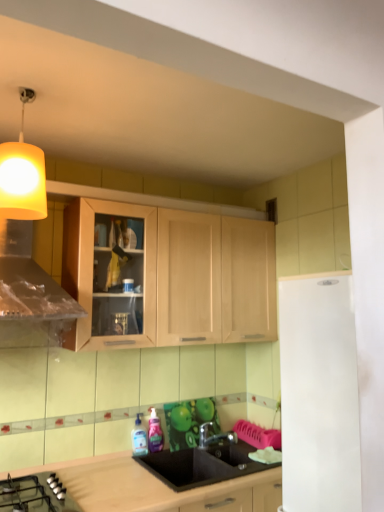
Describe the element at coordinates (33, 495) in the screenshot. I see `black glass gas stove at lower left` at that location.

This screenshot has width=384, height=512. What do you see at coordinates (168, 277) in the screenshot? I see `light wood cabinet at center` at bounding box center [168, 277].

The height and width of the screenshot is (512, 384). What do you see at coordinates (214, 435) in the screenshot?
I see `metallic silver faucet at lower center` at bounding box center [214, 435].

What is the approximate height of black matte sink at center?

The height of black matte sink at center is 8.66 inches.

Identify the location of white matte refrigerator at right. Image resolution: width=384 pixels, height=512 pixels. (319, 393).

Locate an element on the screen. pink glossy bottle at sink, the second bottle in the left-to-right sequence is located at coordinates (155, 433).

Which is behind, point (173, 311) or point (313, 506)?

The point (173, 311) is farther.

Can we say light wood cabinet at center lies outside white matte refrigerator at right?

Yes, light wood cabinet at center is located beyond the bounds of white matte refrigerator at right.

Which object is thinner, light wood cabinet at center or white matte refrigerator at right?

light wood cabinet at center.

Between transparent plastic bottle at sink, marked as the 2th bottle in a right-to-left arrangement, and black glass gas stove at lower left, which one has smaller width?

transparent plastic bottle at sink, marked as the 2th bottle in a right-to-left arrangement, is thinner.

Is transparent plastic bottle at sink, which ranks as the 1th bottle in left-to-right order, located outside black glass gas stove at lower left?

transparent plastic bottle at sink, which ranks as the 1th bottle in left-to-right order, lies outside black glass gas stove at lower left's area.

Is transparent plastic bottle at sink, which ranks as the 1th bottle in left-to-right order, in front of or behind black glass gas stove at lower left in the image?

Visually, transparent plastic bottle at sink, which ranks as the 1th bottle in left-to-right order, is located behind black glass gas stove at lower left.

Who is shorter, pink glossy bottle at sink, marked as the first bottle in a right-to-left arrangement, or yellow fabric lampshade at upper left?

Standing shorter between the two is pink glossy bottle at sink, marked as the first bottle in a right-to-left arrangement.

Can you tell me how much pink glossy bottle at sink, the second bottle in the left-to-right sequence, and yellow fabric lampshade at upper left differ in facing direction?

The angular difference between pink glossy bottle at sink, the second bottle in the left-to-right sequence, and yellow fabric lampshade at upper left is 3.55 degrees.

Is pink glossy bottle at sink, marked as the first bottle in a right-to-left arrangement, next to yellow fabric lampshade at upper left?

pink glossy bottle at sink, marked as the first bottle in a right-to-left arrangement, and yellow fabric lampshade at upper left are clearly separated.

From the image's perspective, is pink glossy bottle at sink, the second bottle in the left-to-right sequence, above yellow fabric lampshade at upper left?

Actually, pink glossy bottle at sink, the second bottle in the left-to-right sequence, appears below yellow fabric lampshade at upper left in the image.

Considering the relative sizes of light wood cabinet at center and black glass gas stove at lower left in the image provided, is light wood cabinet at center taller than black glass gas stove at lower left?

Yes.

Is light wood cabinet at center positioned far away from black glass gas stove at lower left?

Yes, light wood cabinet at center is far from black glass gas stove at lower left.

From a real-world perspective, is light wood cabinet at center located higher than black glass gas stove at lower left?

Yes.

From the image's perspective, does metallic silver faucet at lower center appear lower than transparent plastic bottle at sink, which ranks as the 1th bottle in left-to-right order?

Yes, from the image's perspective, metallic silver faucet at lower center is beneath transparent plastic bottle at sink, which ranks as the 1th bottle in left-to-right order.

Is metallic silver faucet at lower center inside the boundaries of transparent plastic bottle at sink, which ranks as the 1th bottle in left-to-right order, or outside?

metallic silver faucet at lower center is not enclosed by transparent plastic bottle at sink, which ranks as the 1th bottle in left-to-right order.

From a real-world perspective, is metallic silver faucet at lower center above or below transparent plastic bottle at sink, which ranks as the 1th bottle in left-to-right order?

From a real-world perspective, metallic silver faucet at lower center is physically below transparent plastic bottle at sink, which ranks as the 1th bottle in left-to-right order.

In the scene shown: In terms of size, does metallic silver faucet at lower center appear bigger or smaller than transparent plastic bottle at sink, marked as the 2th bottle in a right-to-left arrangement?

Clearly, metallic silver faucet at lower center is larger in size than transparent plastic bottle at sink, marked as the 2th bottle in a right-to-left arrangement.

Considering the points (276, 330) and (232, 438), which point is in front, point (276, 330) or point (232, 438)?

Positioned in front is point (232, 438).

Who is smaller, light wood cabinet at center or metallic silver faucet at lower center?

With smaller size is metallic silver faucet at lower center.

Based on the photo, is the depth of light wood cabinet at center less than that of metallic silver faucet at lower center?

Yes, light wood cabinet at center is in front of metallic silver faucet at lower center.

Is light wood cabinet at center at the right side of metallic silver faucet at lower center?

No.

Between white matte refrigerator at right and metallic silver faucet at lower center, which one has smaller width?

With smaller width is metallic silver faucet at lower center.

Is white matte refrigerator at right facing towards metallic silver faucet at lower center?

No.

Who is bigger, white matte refrigerator at right or metallic silver faucet at lower center?

With larger size is white matte refrigerator at right.

From the image's perspective, who appears lower, white matte refrigerator at right or metallic silver faucet at lower center?

metallic silver faucet at lower center is shown below in the image.

Locate an element on the screen. The height and width of the screenshot is (512, 384). cabinetry located above the white matte refrigerator at right (from the image's perspective) is located at coordinates (168, 277).

Locate an element on the screen. The image size is (384, 512). gas stove below the transparent plastic bottle at sink, marked as the 2th bottle in a right-to-left arrangement (from the image's perspective) is located at coordinates (33, 495).

When comparing their distances from yellow fabric lampshade at upper left, does metallic silver faucet at lower center or white matte refrigerator at right seem further?

Based on the image, metallic silver faucet at lower center appears to be further to yellow fabric lampshade at upper left.

Looking at this image, looking at the image, which one is located further to light wood cabinet at center, pink glossy bottle at sink, the second bottle in the left-to-right sequence, or metallic silver faucet at lower center?

metallic silver faucet at lower center is positioned further to the anchor light wood cabinet at center.

Based on their spatial positions, is pink glossy bottle at sink, marked as the first bottle in a right-to-left arrangement, or black glass gas stove at lower left closer to white matte refrigerator at right?

Based on the image, black glass gas stove at lower left appears to be nearer to white matte refrigerator at right.

Estimate the real-world distances between objects in this image. Which object is further from black matte sink at center, pink glossy bottle at sink, marked as the first bottle in a right-to-left arrangement, or transparent plastic bottle at sink, marked as the 2th bottle in a right-to-left arrangement?

transparent plastic bottle at sink, marked as the 2th bottle in a right-to-left arrangement, is positioned further to the anchor black matte sink at center.

Considering their positions, is white matte refrigerator at right positioned closer to light wood cabinet at center than yellow fabric lampshade at upper left?

yellow fabric lampshade at upper left is closer to light wood cabinet at center.

Estimate the real-world distances between objects in this image. Which object is further from yellow fabric lampshade at upper left, pink glossy bottle at sink, the second bottle in the left-to-right sequence, or transparent plastic bottle at sink, marked as the 2th bottle in a right-to-left arrangement?

pink glossy bottle at sink, the second bottle in the left-to-right sequence, lies further to yellow fabric lampshade at upper left than the other object.

Estimate the real-world distances between objects in this image. Which object is closer to white matte refrigerator at right, black matte sink at center or black glass gas stove at lower left?

Based on the image, black matte sink at center appears to be nearer to white matte refrigerator at right.

Looking at this image, based on their spatial positions, is metallic silver faucet at lower center or transparent plastic bottle at sink, marked as the 2th bottle in a right-to-left arrangement, further from light wood cabinet at center?

metallic silver faucet at lower center.

This screenshot has height=512, width=384. In order to click on sink positioned between white matte refrigerator at right and transparent plastic bottle at sink, marked as the 2th bottle in a right-to-left arrangement, from near to far in this screenshot , I will do point(202,464).

The width and height of the screenshot is (384, 512). Identify the location of sink between white matte refrigerator at right and pink glossy bottle at sink, marked as the first bottle in a right-to-left arrangement, in the front-back direction. (202, 464).

Where is `appliance between yellow fabric lampshade at upper left and metallic silver faucet at lower center from top to bottom`? The height and width of the screenshot is (512, 384). appliance between yellow fabric lampshade at upper left and metallic silver faucet at lower center from top to bottom is located at coordinates (319, 393).

Identify the location of sink between white matte refrigerator at right and metallic silver faucet at lower center along the z-axis. (202, 464).